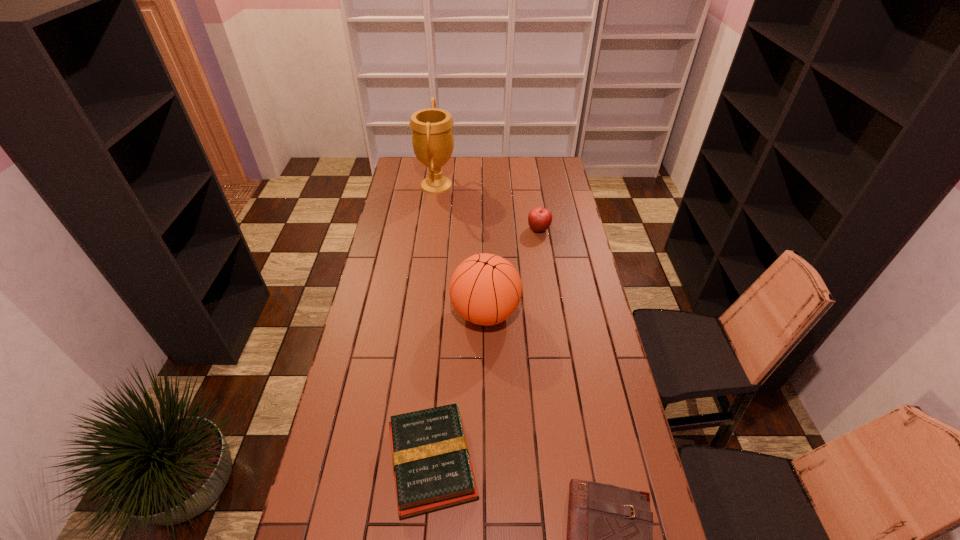
Locate an element on the screen. Image resolution: width=960 pixels, height=540 pixels. vacant space that satisfies the following two spatial constraints: 1. on the engravings side of the taller hardback book; 2. on the left side of the trophy is located at coordinates (400, 462).